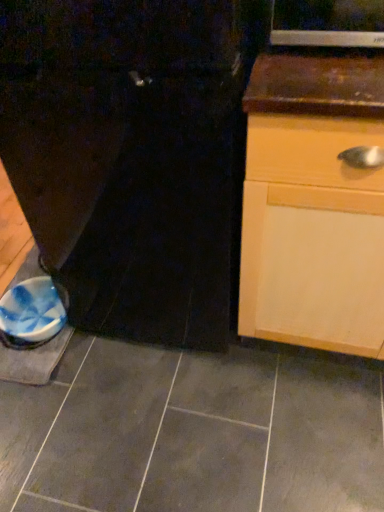
Question: Should I look upward or downward to see gray matte tile at center?

Choices:
 (A) up
 (B) down

Answer: (B)